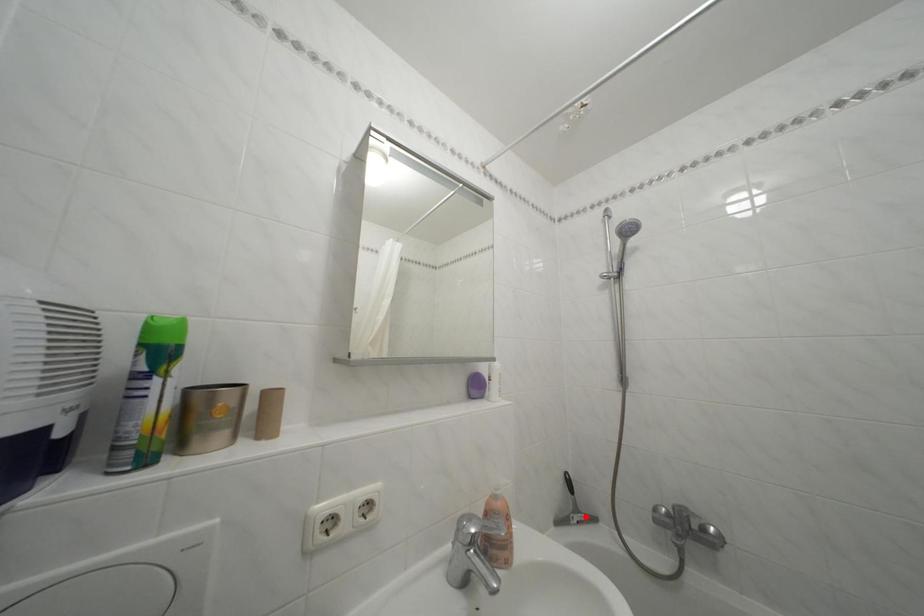
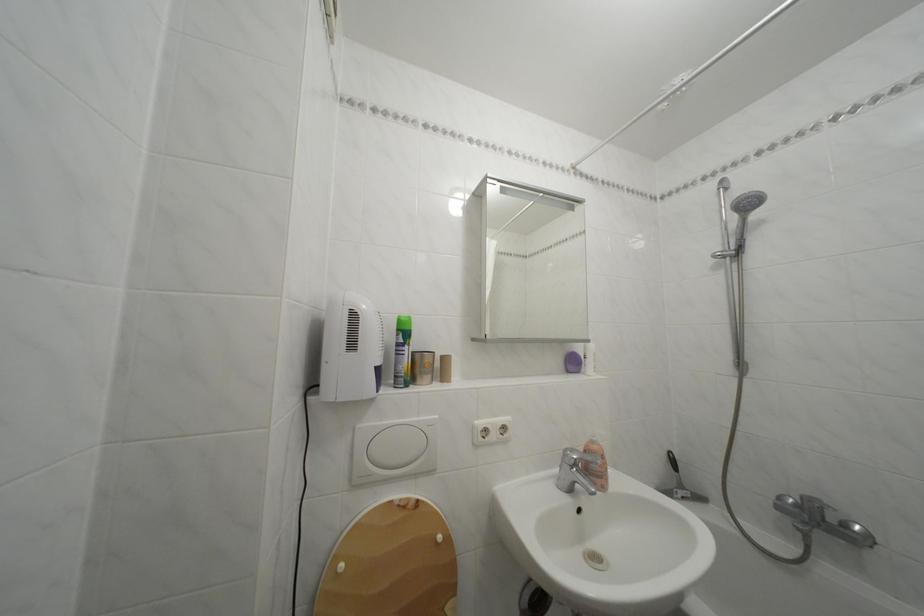
Question: A red point is marked in image1. In image2, is the corresponding 3D point closer to the camera or farther? Reply with the corresponding letter.

Choices:
 (A) The corresponding 3D point is closer.
 (B) The corresponding 3D point is farther.

Answer: (A)